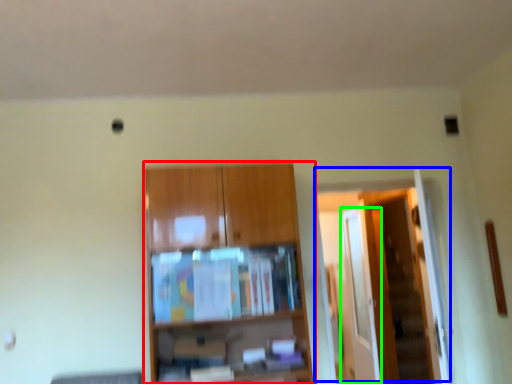
Question: Which object is the closest to the cupboard (highlighted by a red box)? Choose among these: door (highlighted by a blue box) or glass door (highlighted by a green box).

Choices:
 (A) door
 (B) glass door

Answer: (A)